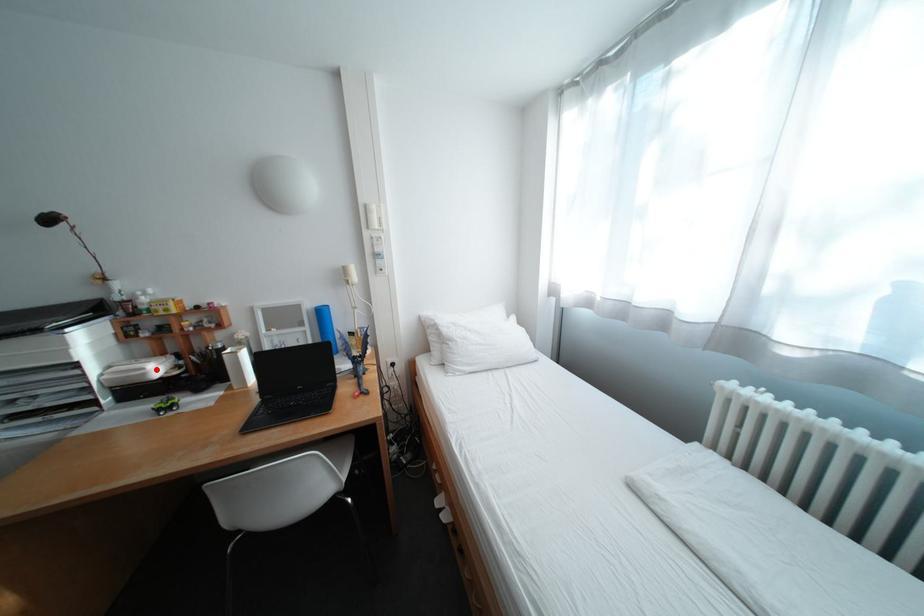
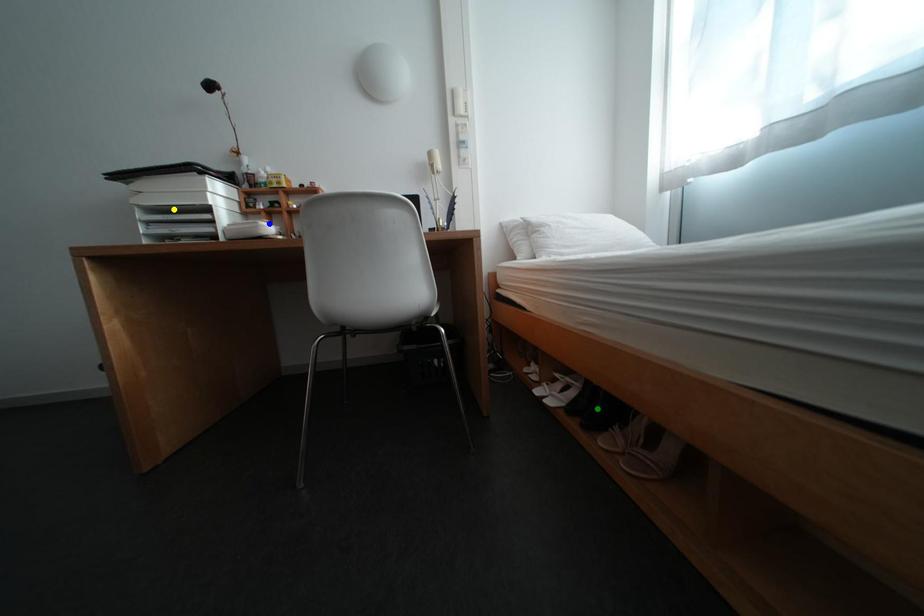
Question: I am providing you with two images of the same scene from different viewpoints. A red point is marked on the first image. You are given multiple points on the second image. Which spot in image 2 lines up with the point in image 1?

Choices:
 (A) yellow point
 (B) blue point
 (C) green point

Answer: (B)